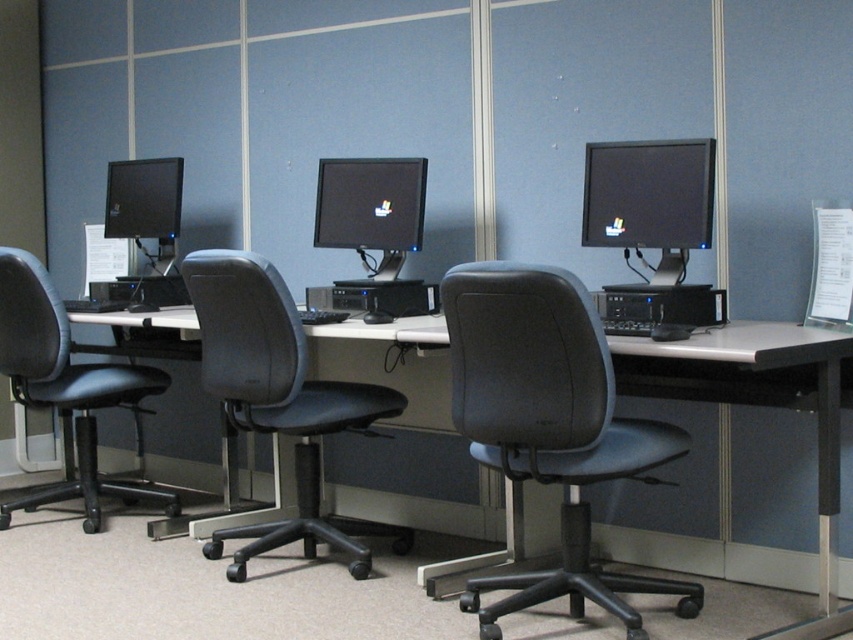
You are setting up a new monitor in the workspace. The new monitor is the same size as the matte black monitor at left. If you want to place it next to the matte black monitor at center, will it fit without overlapping?

The matte black monitor at center is wider than the matte black monitor at left. Since the new monitor is the same size as the matte black monitor at left, it will fit next to the matte black monitor at center without overlapping, as there is sufficient space between them.

You are sitting in a chair and want to reach the keyboard connected to the matte black monitor at center. Which direction should you move to from the black leather swivel chair at left?

Since the black leather swivel chair at left is to the left of the matte black monitor at center, you should move to the right to reach the keyboard connected to the matte black monitor at center.

You are an office worker who needs to adjust the height of your matte black monitor at upper right. You are currently sitting in the gray leather swivel chair at center. Which direction should you move your chair to reach the monitor?

The gray leather swivel chair at center is located below the matte black monitor at upper right, so you should move your chair upward to reach the monitor.